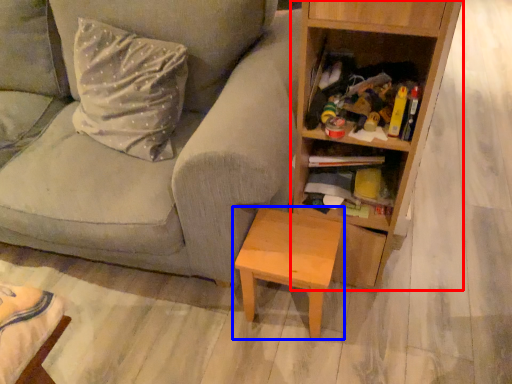
Question: Which object is closer to the camera taking this photo, bookcase (highlighted by a red box) or table (highlighted by a blue box)?

Choices:
 (A) bookcase
 (B) table

Answer: (A)